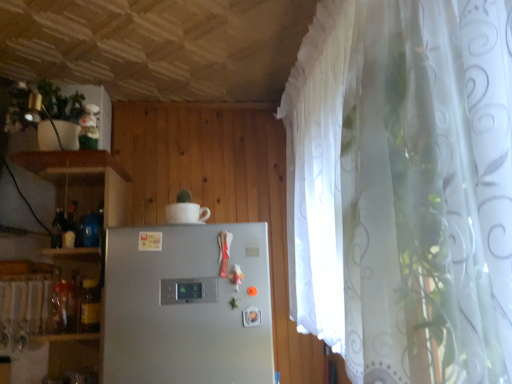
Question: In terms of width, does white glossy cup at upper center look wider or thinner when compared to satin silver refrigerator at center?

Choices:
 (A) thin
 (B) wide

Answer: (A)

Question: Do you think white glossy cup at upper center is within satin silver refrigerator at center, or outside of it?

Choices:
 (A) outside
 (B) inside

Answer: (A)

Question: From the image's perspective, is white glossy cup at upper center located above or below satin silver refrigerator at center?

Choices:
 (A) above
 (B) below

Answer: (A)

Question: Considering the positions of satin silver refrigerator at center and white glossy cup at upper center in the image, is satin silver refrigerator at center taller or shorter than white glossy cup at upper center?

Choices:
 (A) short
 (B) tall

Answer: (B)

Question: Choose the correct answer: Is satin silver refrigerator at center inside white glossy cup at upper center or outside it?

Choices:
 (A) outside
 (B) inside

Answer: (A)

Question: In terms of size, does satin silver refrigerator at center appear bigger or smaller than white glossy cup at upper center?

Choices:
 (A) small
 (B) big

Answer: (B)

Question: From the image's perspective, relative to white glossy cup at upper center, is satin silver refrigerator at center above or below?

Choices:
 (A) above
 (B) below

Answer: (B)